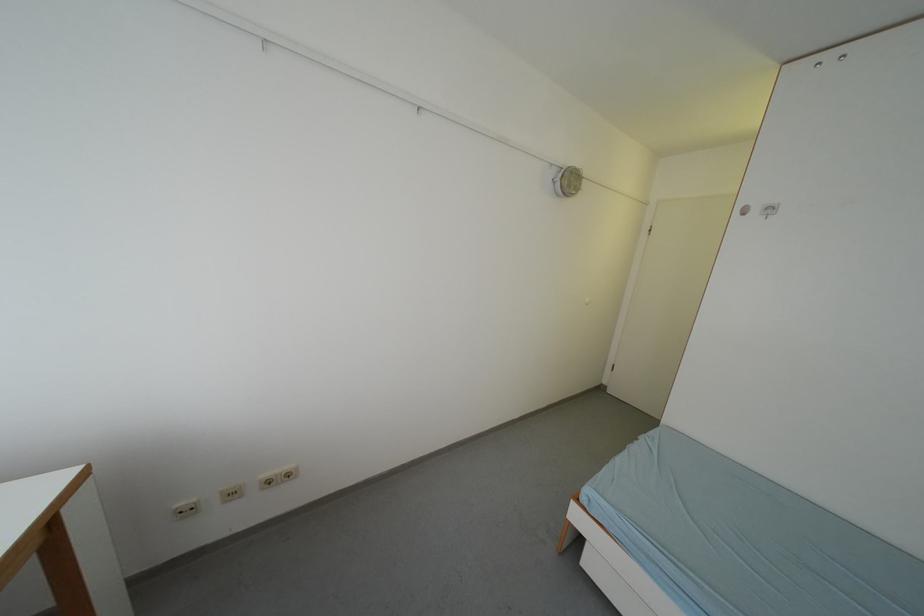
You are a GUI agent. You are given a task and a screenshot of the screen. Output one action in this format:
    pyautogui.click(x=<x>, y=<y>)
    Task: Click on the white double socket
    The image size is (924, 616).
    Given the screenshot: What is the action you would take?
    pyautogui.click(x=186, y=508)